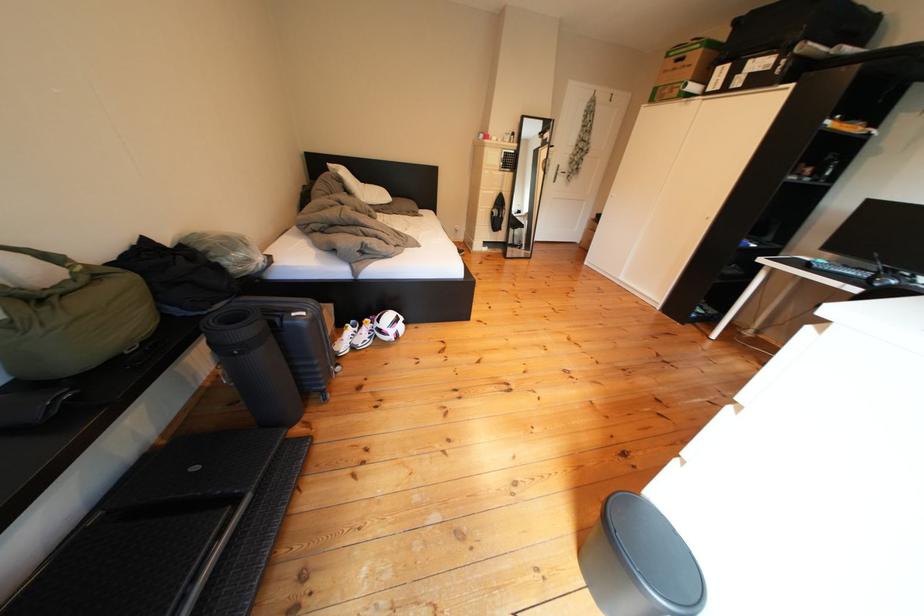
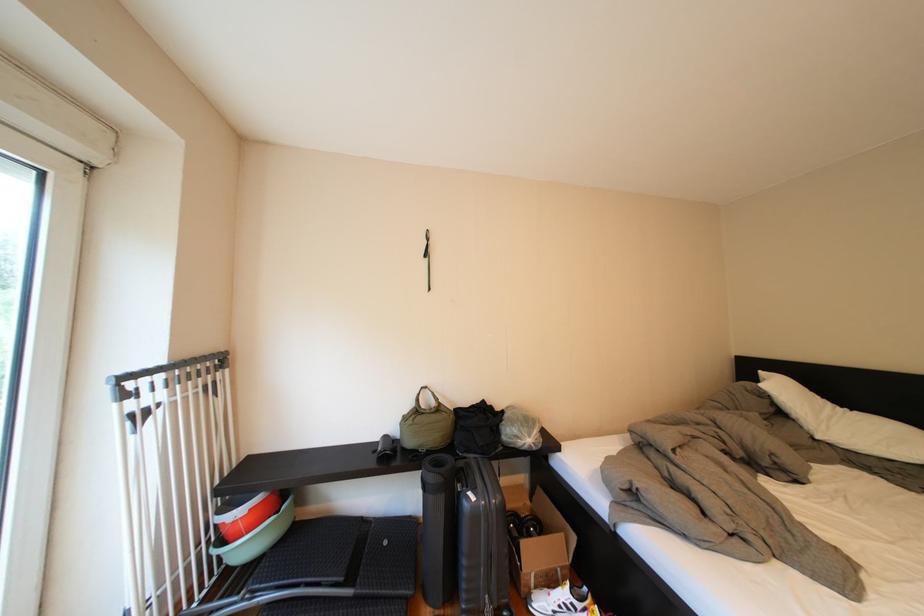
Where in the second image is the point corresponding to (357,353) from the first image?

(554, 609)